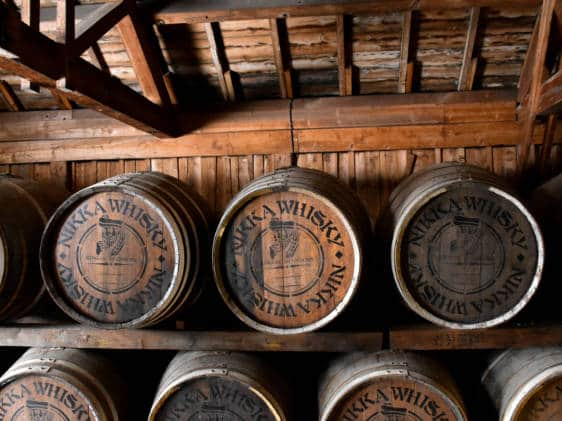
Where is `large space between top shelves`? The height and width of the screenshot is (421, 562). large space between top shelves is located at coordinates (383, 336).